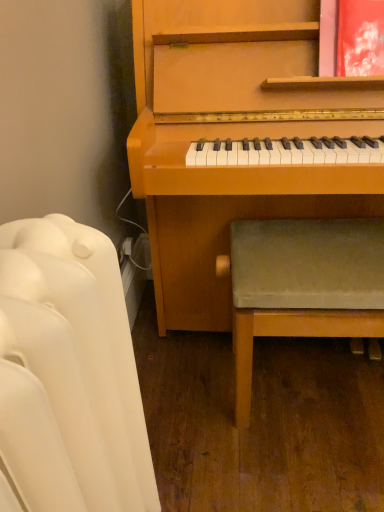
Question: Would you say white tufted sofa at left is to the left or to the right of green fabric stool at lower right in the picture?

Choices:
 (A) right
 (B) left

Answer: (B)

Question: Looking at the image, does white tufted sofa at left seem bigger or smaller compared to green fabric stool at lower right?

Choices:
 (A) big
 (B) small

Answer: (B)

Question: From their relative heights in the image, would you say white tufted sofa at left is taller or shorter than green fabric stool at lower right?

Choices:
 (A) short
 (B) tall

Answer: (B)

Question: Is point (289, 332) positioned closer to the camera than point (69, 412)?

Choices:
 (A) farther
 (B) closer

Answer: (A)

Question: From the image's perspective, is green fabric stool at lower right positioned above or below white tufted sofa at left?

Choices:
 (A) above
 (B) below

Answer: (A)

Question: Is green fabric stool at lower right taller or shorter than white tufted sofa at left?

Choices:
 (A) tall
 (B) short

Answer: (B)

Question: In the image, is green fabric stool at lower right on the left side or the right side of white tufted sofa at left?

Choices:
 (A) right
 (B) left

Answer: (A)